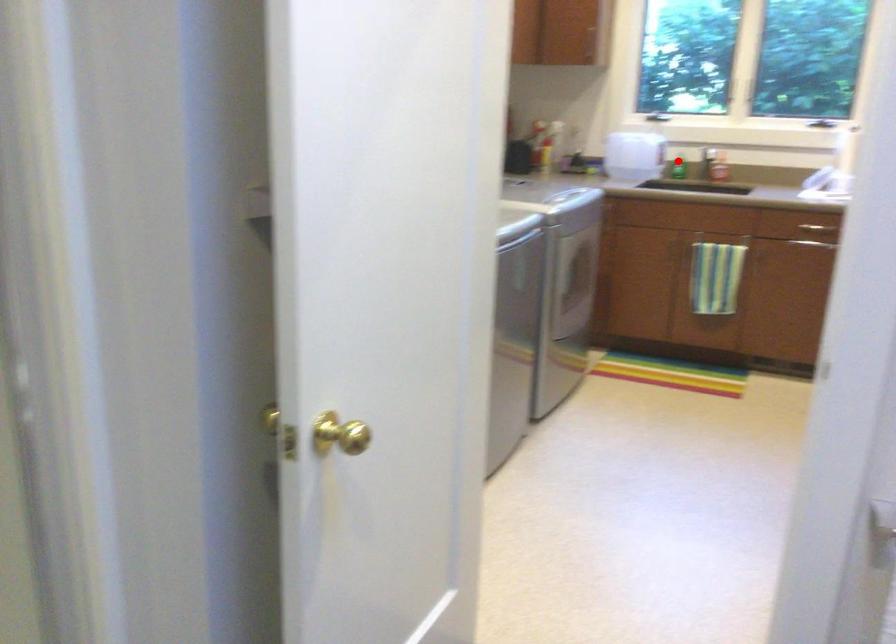
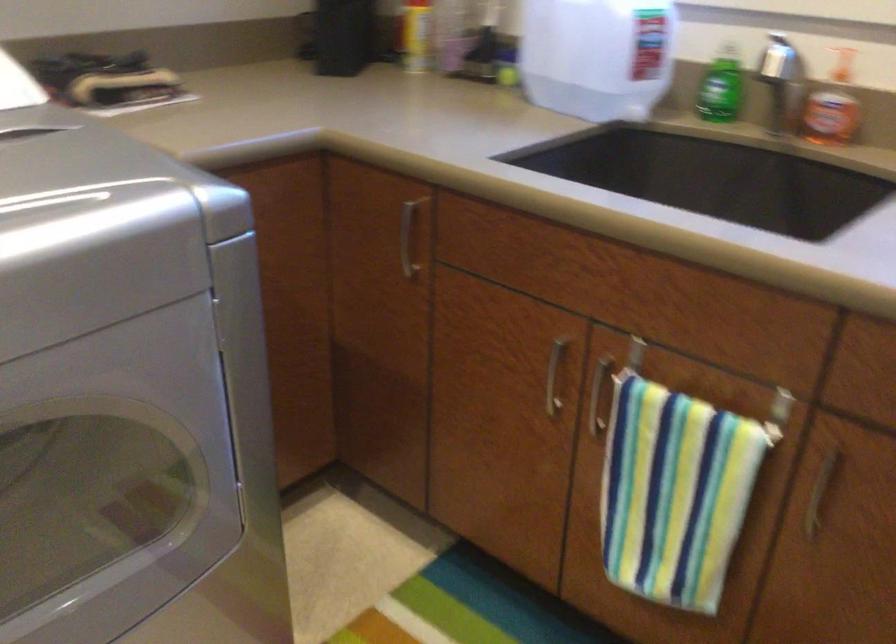
In the second image, find the point that corresponds to the highlighted location in the first image.

(721, 88)